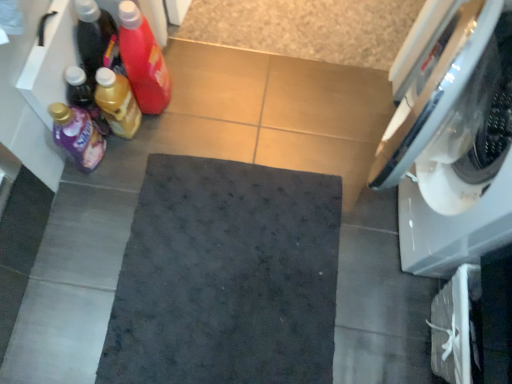
Question: Relative to translucent plastic bottle at left, the 2th bottle from the left, is dark matte bath mat at center in front or behind?

Choices:
 (A) behind
 (B) front

Answer: (B)

Question: Is dark matte bath mat at center wider or thinner than translucent plastic bottle at left, the 3th bottle when ordered from right to left?

Choices:
 (A) thin
 (B) wide

Answer: (B)

Question: Which object is positioned closest to the purple glossy detergent at left, arranged as the 1th bottle when viewed from the left?

Choices:
 (A) dark matte bath mat at center
 (B) translucent plastic bottle at left, marked as the fourth bottle in a left-to-right arrangement
 (C) translucent plastic bottle at left, the third bottle when ordered from left to right
 (D) translucent plastic bottle at left, the 3th bottle when ordered from right to left
 (E) white glossy washing machine at right

Answer: (D)

Question: Which is farther from the translucent plastic bottle at left, marked as the fourth bottle in a left-to-right arrangement?

Choices:
 (A) translucent plastic bottle at left, the 2th bottle when ordered from right to left
 (B) translucent plastic bottle at left, the 2th bottle from the left
 (C) dark matte bath mat at center
 (D) white glossy washing machine at right
 (E) purple glossy detergent at left, arranged as the 1th bottle when viewed from the left

Answer: (D)